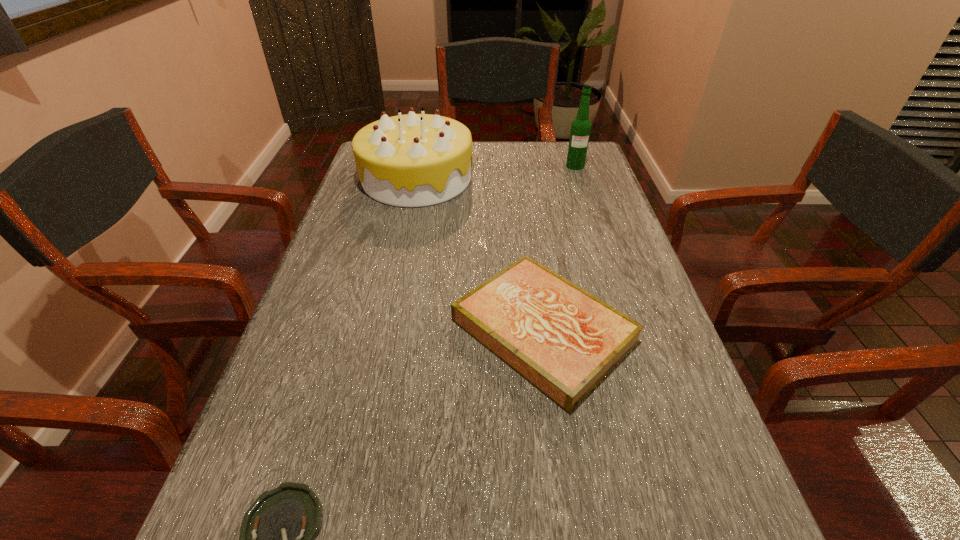
Identify the location of the tallest object. (581, 126).

I want to click on the third shortest object, so click(414, 160).

Identify the location of the third tallest object. (563, 340).

Find the location of a particular element. hardback book is located at coordinates (563, 340).

Find the location of a particular element. Image resolution: width=960 pixels, height=540 pixels. free space located 0.180m on the label of the beer bottle is located at coordinates (588, 202).

Where is `vacant space located on the front of the birthday cake`? vacant space located on the front of the birthday cake is located at coordinates (397, 272).

Image resolution: width=960 pixels, height=540 pixels. I want to click on vacant area situated on the front of the third farthest object, so click(x=563, y=472).

Locate an element on the screen. This screenshot has height=540, width=960. beer bottle that is positioned at the far edge is located at coordinates (581, 126).

Where is `birthday cake situated at the far edge`? This screenshot has height=540, width=960. birthday cake situated at the far edge is located at coordinates (414, 160).

I want to click on object that is positioned at the left edge, so click(414, 160).